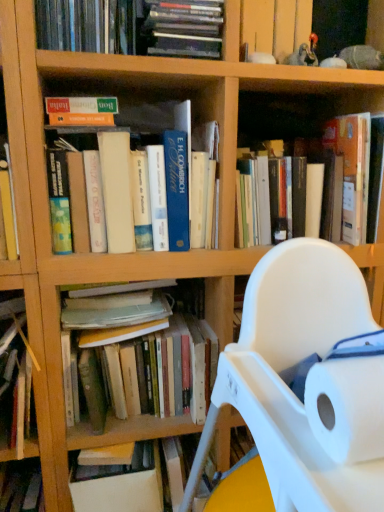
Question: Which is correct: matte green book at upper left, placed as the fifth book when sorted from bottom to top, is inside hardcover books at upper left, arranged as the 4th book when viewed from the top, or outside of it?

Choices:
 (A) outside
 (B) inside

Answer: (B)

Question: From their relative heights in the image, would you say matte green book at upper left, which is counted as the second book, starting from the top, is taller or shorter than hardcover books at upper left, which appears as the third book when ordered from the bottom?

Choices:
 (A) tall
 (B) short

Answer: (B)

Question: Estimate the real-world distances between objects in this image. Which object is closer to the hardcover book at center, the 3th book positioned from the top?

Choices:
 (A) white plastic chair at center
 (B) hardcover books at center, acting as the 1th book starting from the bottom
 (C) white paper at right
 (D) hardcover book at lower left, which is the second book in bottom-to-top order
 (E) matte green book at upper left, which is counted as the second book, starting from the top

Answer: (A)

Question: Based on their relative distances, which object is farther from the white paper at right?

Choices:
 (A) hardcover book at center, the 3th book positioned from the top
 (B) matte green book at upper left, placed as the fifth book when sorted from bottom to top
 (C) white plastic chair at center
 (D) hardcover books at upper left, arranged as the 4th book when viewed from the top
 (E) hardcover books at upper center, the first book positioned from the top

Answer: (E)